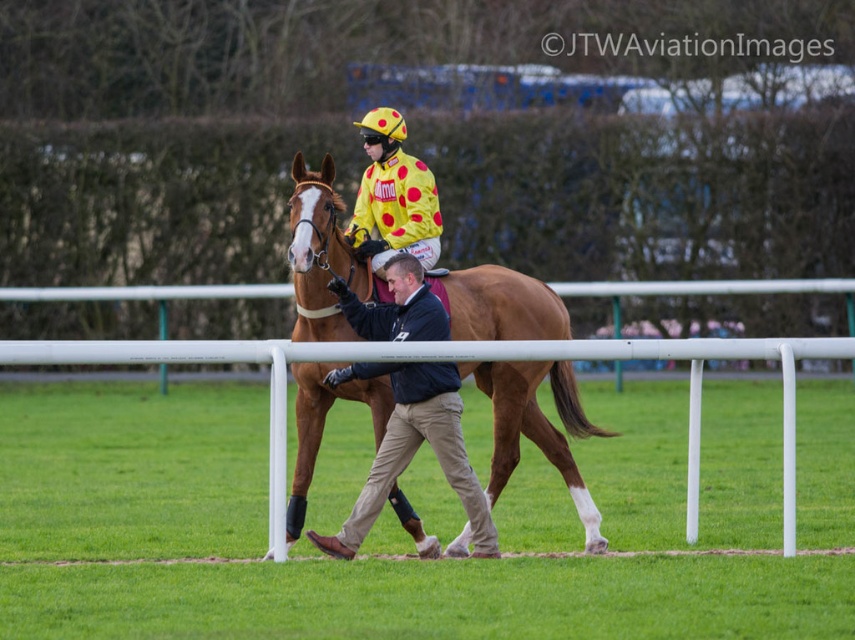
Is white plastic rail at center wider than dark blue jacket at center?

Yes, white plastic rail at center is wider than dark blue jacket at center.

Describe the element at coordinates (461, 358) in the screenshot. I see `white plastic rail at center` at that location.

Image resolution: width=855 pixels, height=640 pixels. Identify the location of white plastic rail at center. click(461, 358).

Which is behind, point (513, 410) or point (385, 364)?

Positioned behind is point (513, 410).

Is brown glossy horse at center below dark blue jacket at center?

No, brown glossy horse at center is not below dark blue jacket at center.

Which is behind, point (332, 333) or point (392, 259)?

The point (332, 333) is more distant.

Locate an element on the screen. The width and height of the screenshot is (855, 640). brown glossy horse at center is located at coordinates (537, 428).

Is dark blue jacket at center closer to camera compared to yellow dotted fabric at center?

Yes.

Is dark blue jacket at center shorter than yellow dotted fabric at center?

No, dark blue jacket at center is not shorter than yellow dotted fabric at center.

Image resolution: width=855 pixels, height=640 pixels. I want to click on dark blue jacket at center, so click(x=413, y=449).